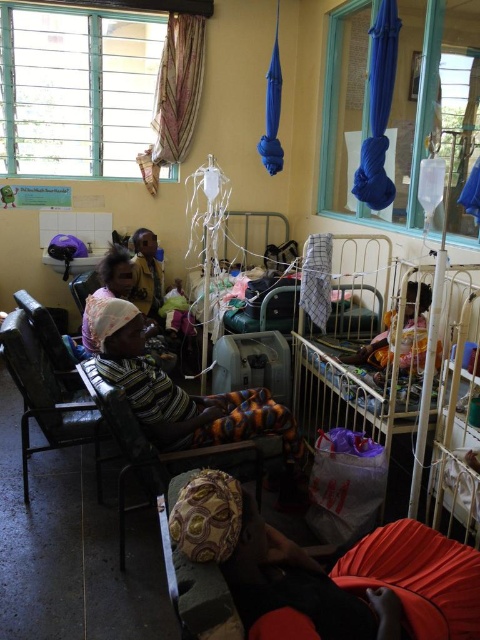
Can you confirm if leather-like chair at left is smaller than wooden fabric chair at center?

Actually, leather-like chair at left might be larger than wooden fabric chair at center.

Does point (97, 468) come in front of point (108, 422)?

No, (97, 468) is behind (108, 422).

The image size is (480, 640). What are the coordinates of `leather-like chair at left` in the screenshot? It's located at (46, 397).

Is metallic white hospital bed at lower right shorter than wooden fabric chair at center?

No.

Between metallic white hospital bed at lower right and wooden fabric chair at center, which one has more height?

metallic white hospital bed at lower right

Between point (297, 326) and point (213, 460), which one is positioned behind?

The point (297, 326) is behind.

At what (x,y) coordinates should I click in order to perform the action: click on metallic white hospital bed at lower right. Please return your answer as a coordinate pair (x, y). This screenshot has width=480, height=640. Looking at the image, I should click on (385, 362).

Can you confirm if wooden fabric chair at center is positioned below dark brown fabric at center?

Correct, wooden fabric chair at center is located below dark brown fabric at center.

Which of these two, wooden fabric chair at center or dark brown fabric at center, stands shorter?

dark brown fabric at center

Is point (164, 481) positioned behind point (405, 365)?

No.

Locate an element on the screen. wooden fabric chair at center is located at coordinates (157, 449).